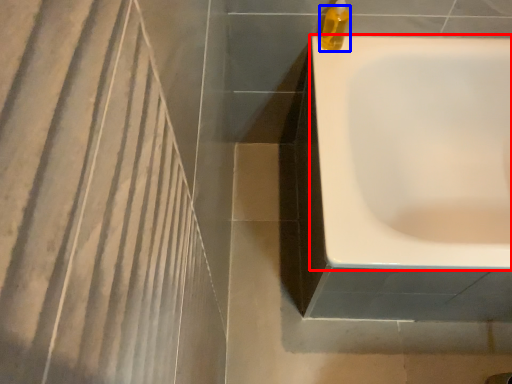
Question: Which of the following is the farthest to the observer, bathtub (highlighted by a red box) or liquid (highlighted by a blue box)?

Choices:
 (A) bathtub
 (B) liquid

Answer: (B)